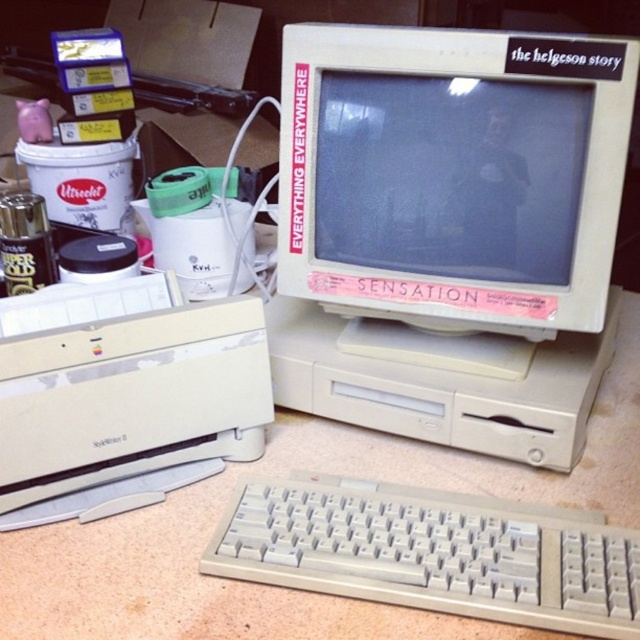
Does point (602, 72) lie behind point (97, 337)?

Yes, point (602, 72) is behind point (97, 337).

Does white plastic monitor at center come in front of white plastic printer at lower left?

No.

What do you see at coordinates (452, 173) in the screenshot?
I see `white plastic monitor at center` at bounding box center [452, 173].

I want to click on white plastic monitor at center, so click(452, 173).

Between white plastic printer at lower left and white plastic keyboard at lower center, which one has less height?

Standing shorter between the two is white plastic keyboard at lower center.

Can you confirm if white plastic printer at lower left is shorter than white plastic keyboard at lower center?

No, white plastic printer at lower left is not shorter than white plastic keyboard at lower center.

In the scene shown: Who is more forward, (150, 452) or (592, 604)?

Positioned in front is point (592, 604).

I want to click on white plastic printer at lower left, so click(125, 385).

The image size is (640, 640). Describe the element at coordinates (452, 173) in the screenshot. I see `white plastic monitor at center` at that location.

Who is shorter, white plastic monitor at center or white plastic keyboard at lower center?

With less height is white plastic keyboard at lower center.

Between point (573, 326) and point (328, 496), which one is positioned in front?

Point (328, 496) is more forward.

You are a GUI agent. You are given a task and a screenshot of the screen. Output one action in this format:
    pyautogui.click(x=<x>, y=<y>)
    Task: Click on the white plastic monitor at center
    Image resolution: width=640 pixels, height=640 pixels.
    Given the screenshot: What is the action you would take?
    pyautogui.click(x=452, y=173)